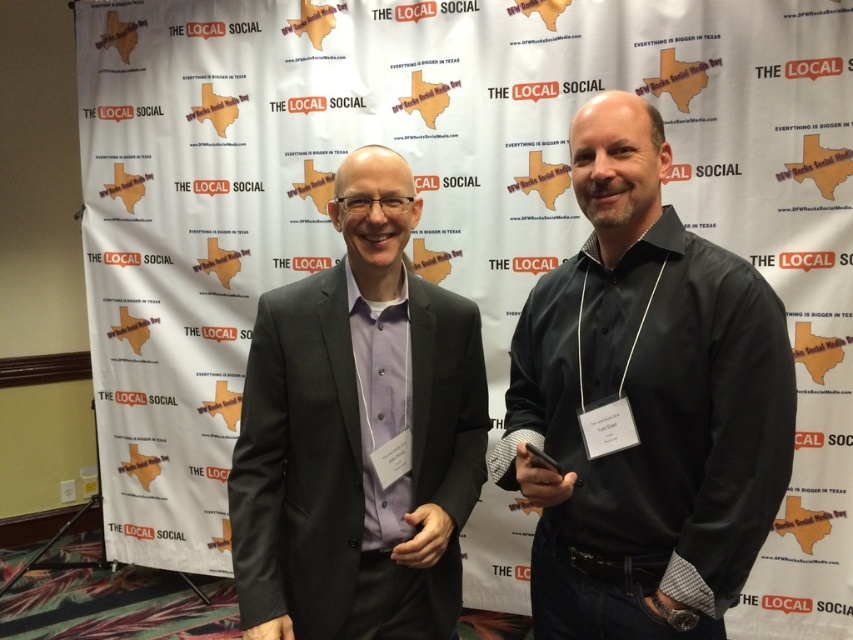
Which is more to the right, black matte shirt at right or matte black suit at center?

Positioned to the right is black matte shirt at right.

Can you confirm if black matte shirt at right is thinner than matte black suit at center?

Indeed, black matte shirt at right has a lesser width compared to matte black suit at center.

Describe the element at coordinates (643, 404) in the screenshot. I see `black matte shirt at right` at that location.

The width and height of the screenshot is (853, 640). I want to click on black matte shirt at right, so click(x=643, y=404).